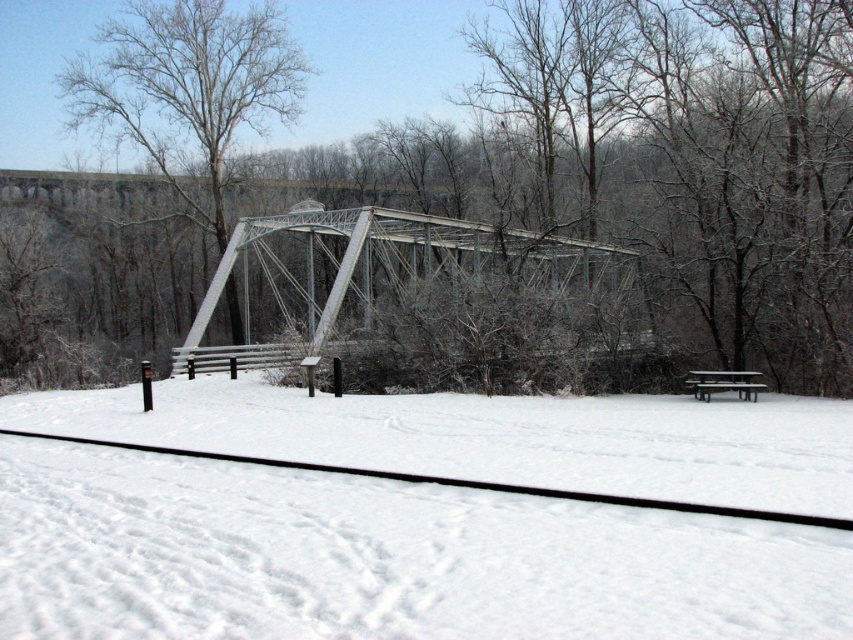
Who is positioned more to the right, white snow at center or wooden picnic table at lower right?

From the viewer's perspective, wooden picnic table at lower right appears more on the right side.

Between white snow at center and wooden picnic table at lower right, which one has more height?

wooden picnic table at lower right is taller.

What do you see at coordinates (380, 557) in the screenshot?
I see `white snow at center` at bounding box center [380, 557].

Find the location of `white snow at center`. white snow at center is located at coordinates (380, 557).

Describe the element at coordinates (341, 257) in the screenshot. I see `metallic gray bridge at center` at that location.

Is point (415, 232) positioned in front of point (746, 372)?

No, it is not.

Is point (566, 248) behind point (744, 394)?

Yes.

I want to click on metallic gray bridge at center, so click(341, 257).

Looking at this image, who is higher up, bare wood tree at upper center or metallic gray bridge at center?

bare wood tree at upper center is above.

Can you confirm if bare wood tree at upper center is thinner than metallic gray bridge at center?

Correct, bare wood tree at upper center's width is less than metallic gray bridge at center's.

Does point (160, 157) come behind point (572, 241)?

Yes, it is.

At what (x,y) coordinates should I click in order to perform the action: click on bare wood tree at upper center. Please return your answer as a coordinate pair (x, y). Looking at the image, I should click on (187, 88).